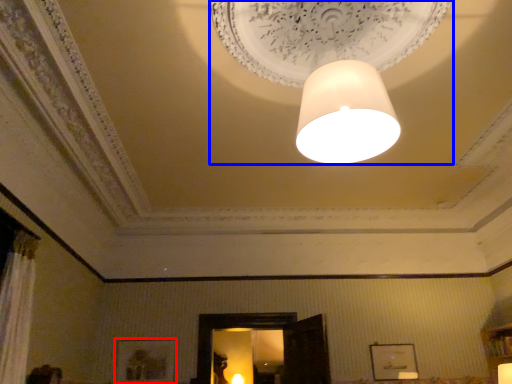
Question: Which object is closer to the camera taking this photo, picture frame (highlighted by a red box) or lamp (highlighted by a blue box)?

Choices:
 (A) picture frame
 (B) lamp

Answer: (B)